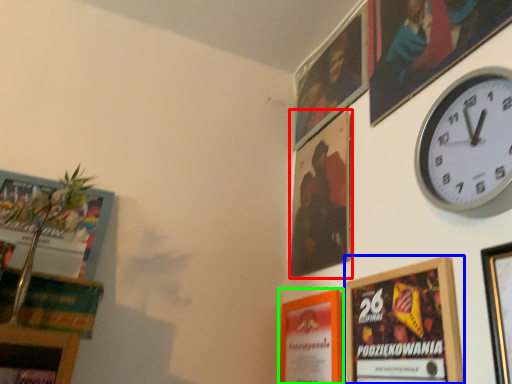
Question: Which object is positioned closest to picture frame (highlighted by a red box)? Select from picture frame (highlighted by a blue box) and picture frame (highlighted by a green box).

Choices:
 (A) picture frame
 (B) picture frame

Answer: (B)